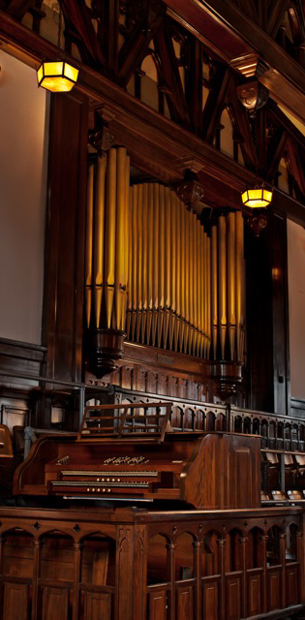
The height and width of the screenshot is (620, 305). Identify the location of walls. (25, 270), (297, 264).